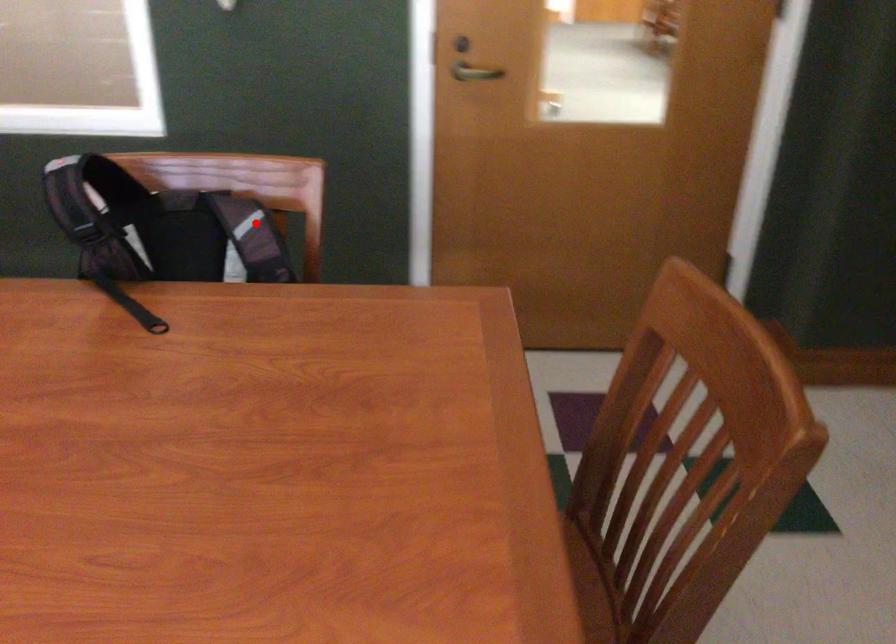
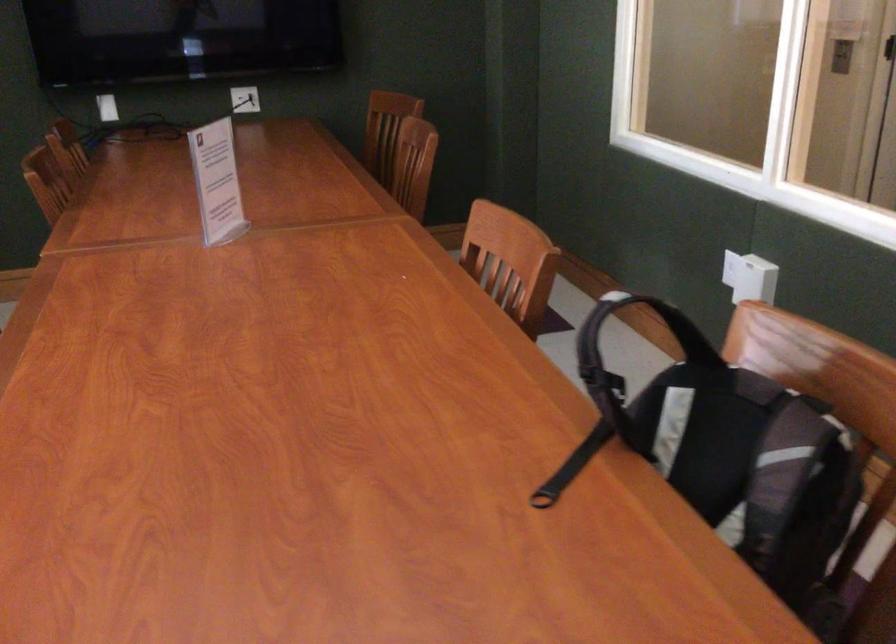
Question: I am providing you with two images of the same scene from different viewpoints. In image1, a red point is highlighted. Considering the same 3D point in image2, which of the following is correct?

Choices:
 (A) It is closer
 (B) It is farther

Answer: (A)